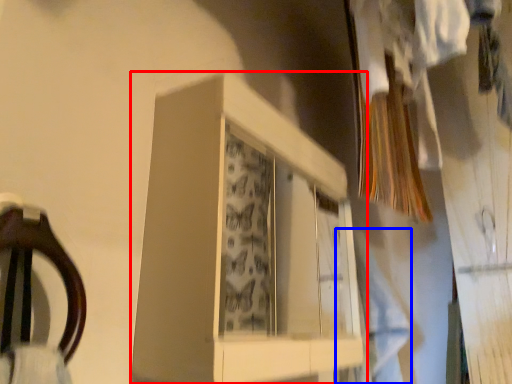
Question: Among these objects, which one is farthest to the camera, cabinet (highlighted by a red box) or clothing (highlighted by a blue box)?

Choices:
 (A) cabinet
 (B) clothing

Answer: (B)